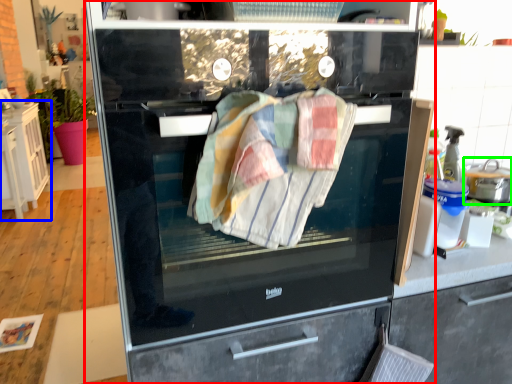
Question: Which is nearer to the home appliance (highlighted by a red box)? cabinetry (highlighted by a blue box) or kitchen appliance (highlighted by a green box).

Choices:
 (A) cabinetry
 (B) kitchen appliance

Answer: (B)